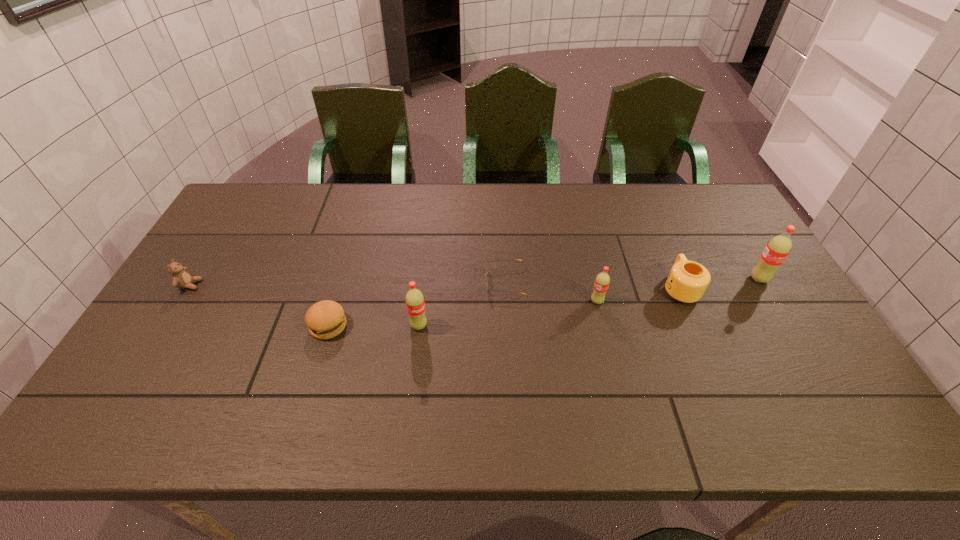
Where is `soda that stands as the second closest to the second soda from right to left`? soda that stands as the second closest to the second soda from right to left is located at coordinates (415, 304).

This screenshot has height=540, width=960. Identify the location of the closest soda to the second object from right to left. (777, 249).

Identify the location of vacant space that satisfies the following two spatial constraints: 1. on the front-facing side of the leftmost object; 2. on the handle side of the mug. This screenshot has height=540, width=960. (188, 289).

You are a GUI agent. You are given a task and a screenshot of the screen. Output one action in this format:
    pyautogui.click(x=<x>, y=<y>)
    Task: Click on the vacant space that satisfies the following two spatial constraints: 1. on the back side of the second nearest soda; 2. on the left side of the leftmost soda
    The width and height of the screenshot is (960, 540).
    Given the screenshot: What is the action you would take?
    pyautogui.click(x=421, y=301)

Where is `free space that satisfies the following two spatial constraints: 1. on the front-facing side of the leftmost soda; 2. on the left side of the teddy bear`? This screenshot has height=540, width=960. free space that satisfies the following two spatial constraints: 1. on the front-facing side of the leftmost soda; 2. on the left side of the teddy bear is located at coordinates (165, 326).

The width and height of the screenshot is (960, 540). What are the coordinates of `free space that satisfies the following two spatial constraints: 1. on the handle side of the farthest soda; 2. on the left side of the mug` in the screenshot? It's located at (676, 279).

Locate an element on the screen. Image resolution: width=960 pixels, height=540 pixels. free space that satisfies the following two spatial constraints: 1. on the handle side of the mug; 2. on the front-facing side of the teddy bear is located at coordinates (678, 285).

The image size is (960, 540). I want to click on vacant space that satisfies the following two spatial constraints: 1. on the handle side of the tallest soda; 2. on the left side of the second object from right to left, so click(676, 279).

Where is `free spot that satisfies the following two spatial constraints: 1. on the front-facing side of the sixth tallest object; 2. on the right side of the teddy bear`? Image resolution: width=960 pixels, height=540 pixels. free spot that satisfies the following two spatial constraints: 1. on the front-facing side of the sixth tallest object; 2. on the right side of the teddy bear is located at coordinates (165, 326).

You are a GUI agent. You are given a task and a screenshot of the screen. Output one action in this format:
    pyautogui.click(x=<x>, y=<y>)
    Task: Click on the vacant space that satisfies the following two spatial constraints: 1. on the back side of the tallest object; 2. on the right side of the fifth shortest object
    
    Given the screenshot: What is the action you would take?
    pyautogui.click(x=591, y=279)